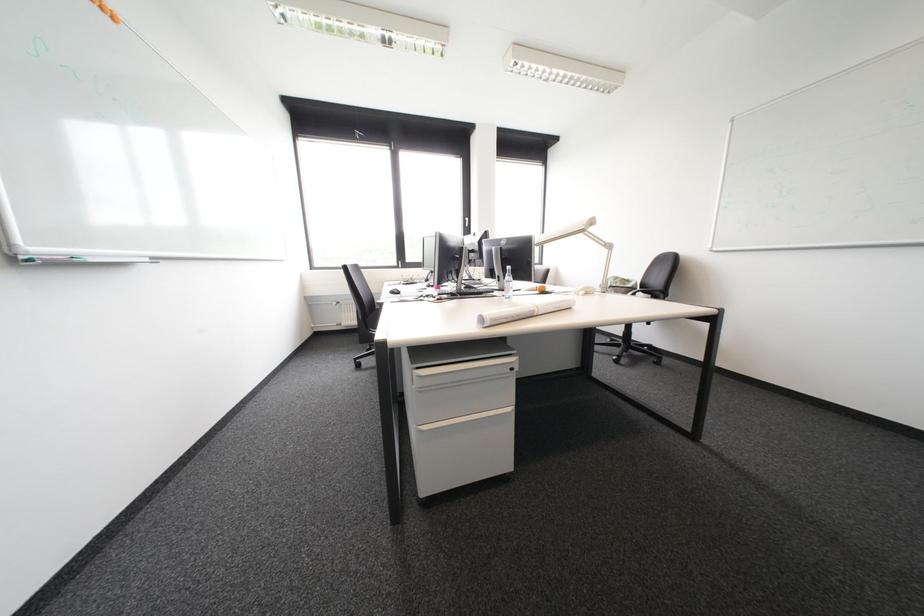
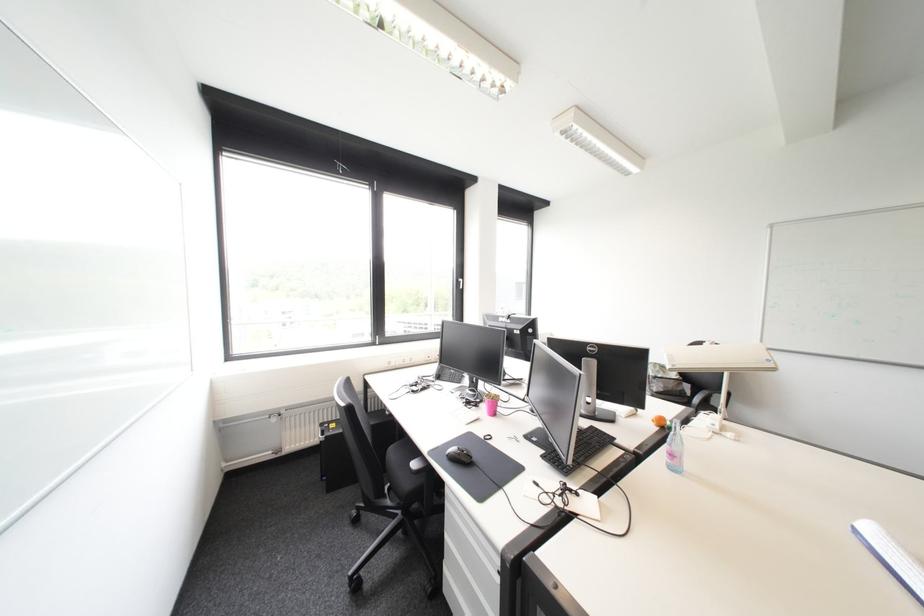
In the second image, find the point that corresponds to (553,291) in the first image.

(673, 424)